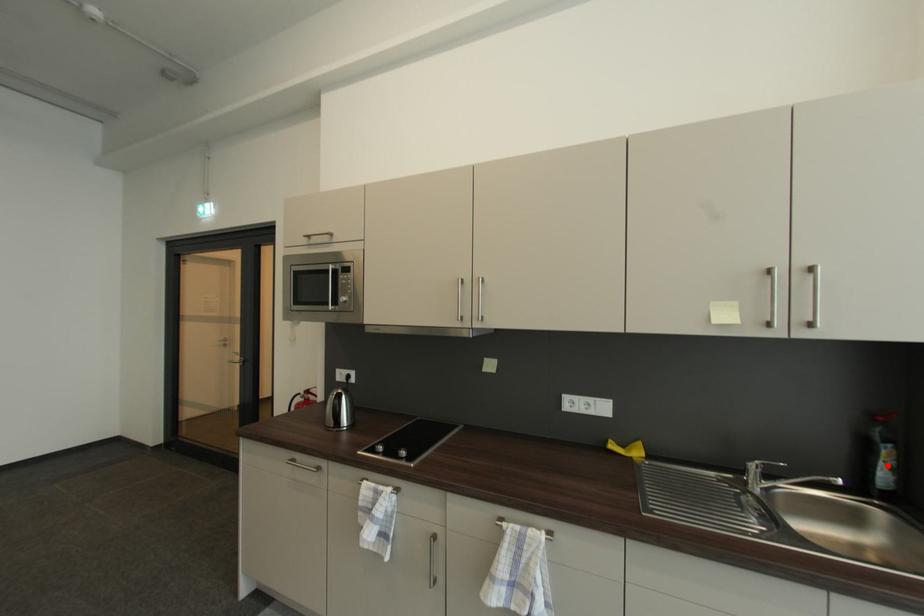
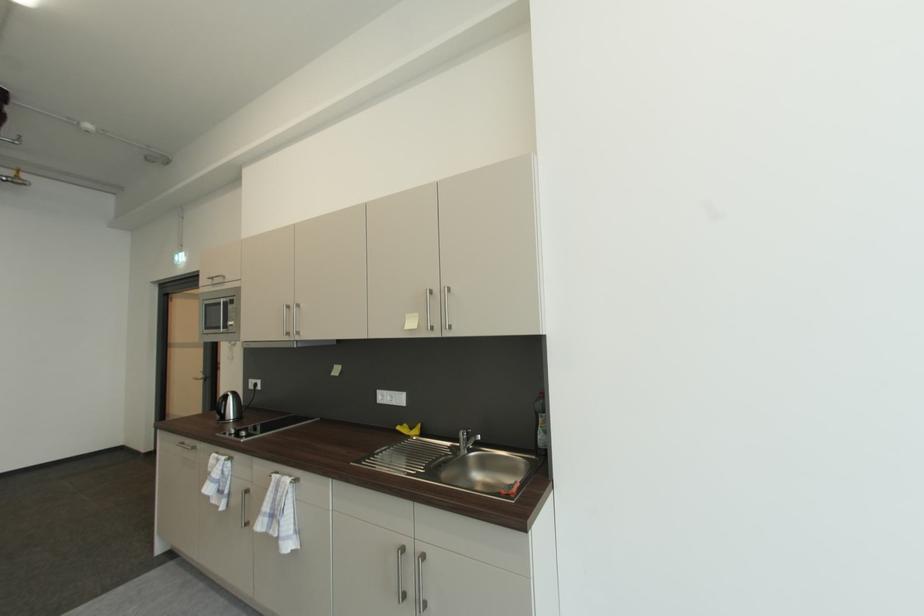
Locate, in the second image, the point that corresponds to the highlighted location in the first image.

(545, 430)